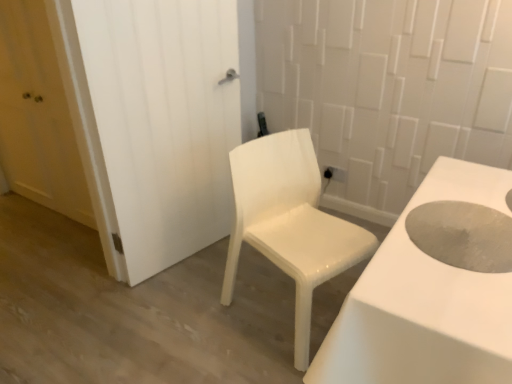
Locate an element on the screen. The width and height of the screenshot is (512, 384). vacant space situated above gray matte hole at center right (from a real-world perspective) is located at coordinates (473, 236).